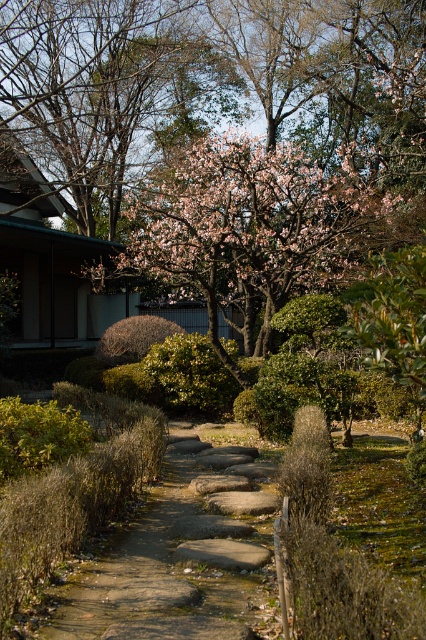
Who is more distant from viewer, (0, 474) or (123, 356)?

The point (123, 356) is more distant.

Can you confirm if green leafy bush at lower left is smaller than brown textured bush at center?

Yes.

Does point (32, 451) lie behind point (111, 330)?

That is False.

At what (x,y) coordinates should I click in order to perform the action: click on green leafy bush at lower left. Please return your answer as a coordinate pair (x, y). Looking at the image, I should click on (37, 435).

Is point (423, 108) positioned before point (158, 336)?

No, (423, 108) is behind (158, 336).

Who is lower down, pink blossom tree at upper center or brown textured bush at center?

Positioned lower is brown textured bush at center.

Find the location of `pink blossom tree at upper center`. pink blossom tree at upper center is located at coordinates (227, 134).

The height and width of the screenshot is (640, 426). I want to click on pink blossom tree at upper center, so click(227, 134).

Does green leafy bush at center appear under brown textured bush at center?

Yes, green leafy bush at center is below brown textured bush at center.

Does green leafy bush at center have a lesser height compared to brown textured bush at center?

Incorrect, green leafy bush at center's height does not fall short of brown textured bush at center's.

Which is behind, point (196, 365) or point (121, 340)?

Positioned behind is point (121, 340).

You are a GUI agent. You are given a task and a screenshot of the screen. Output one action in this format:
    pyautogui.click(x=<x>, y=<y>)
    Task: Click on the green leafy bush at center
    This screenshot has width=426, height=640.
    Given the screenshot: What is the action you would take?
    pyautogui.click(x=190, y=376)